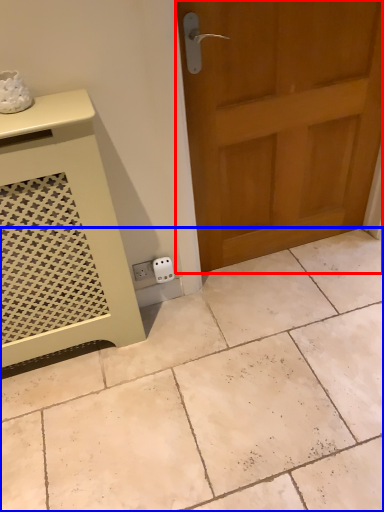
Question: Which of the following is the closest to the observer, door (highlighted by a red box) or ceramic tile (highlighted by a blue box)?

Choices:
 (A) door
 (B) ceramic tile

Answer: (B)